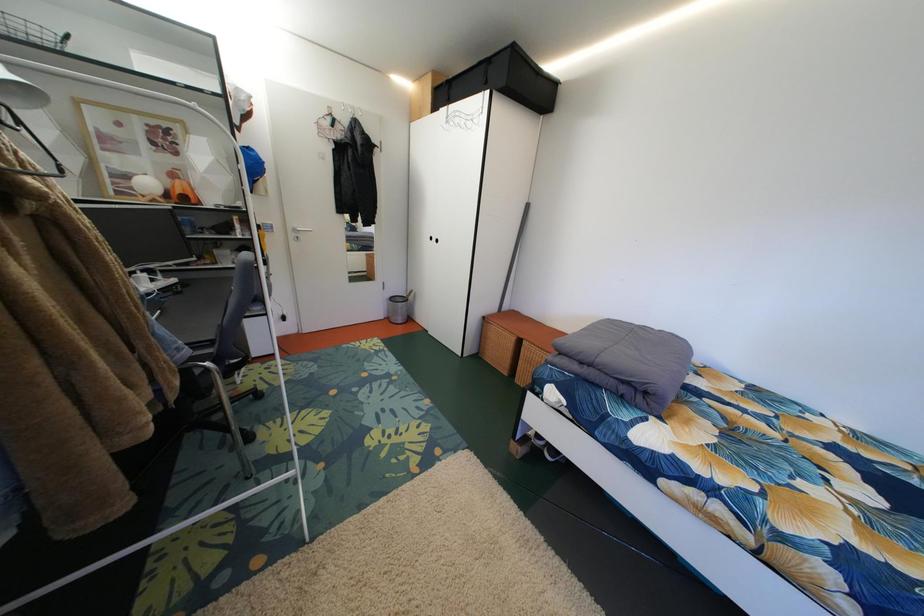
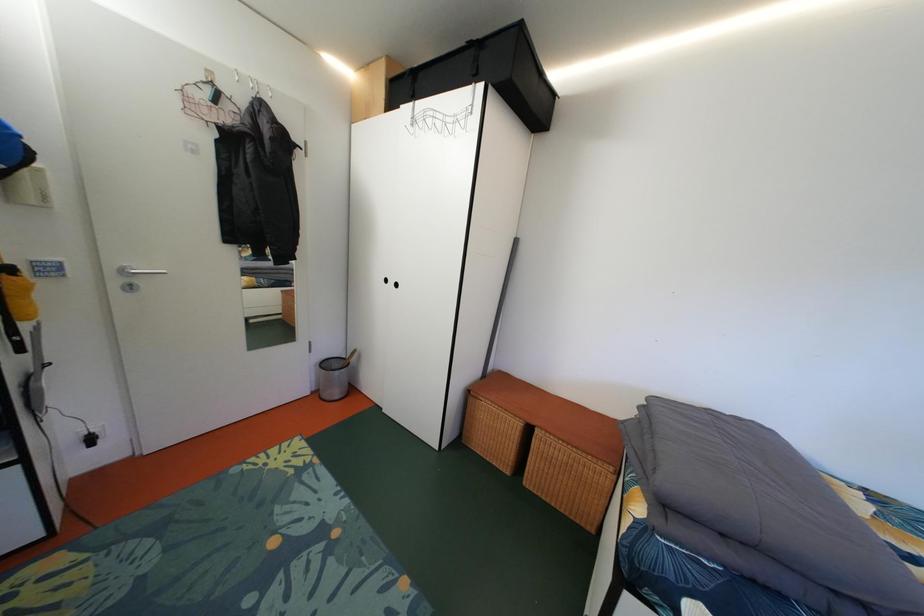
In a continuous first-person perspective shot, in which direction is the camera moving?

The movement direction of the cameraman is left, forward.